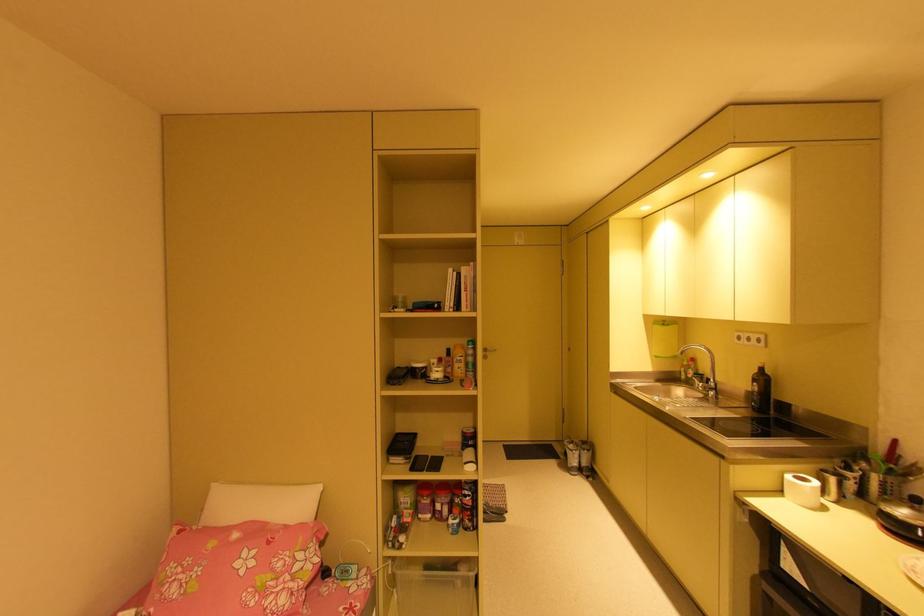
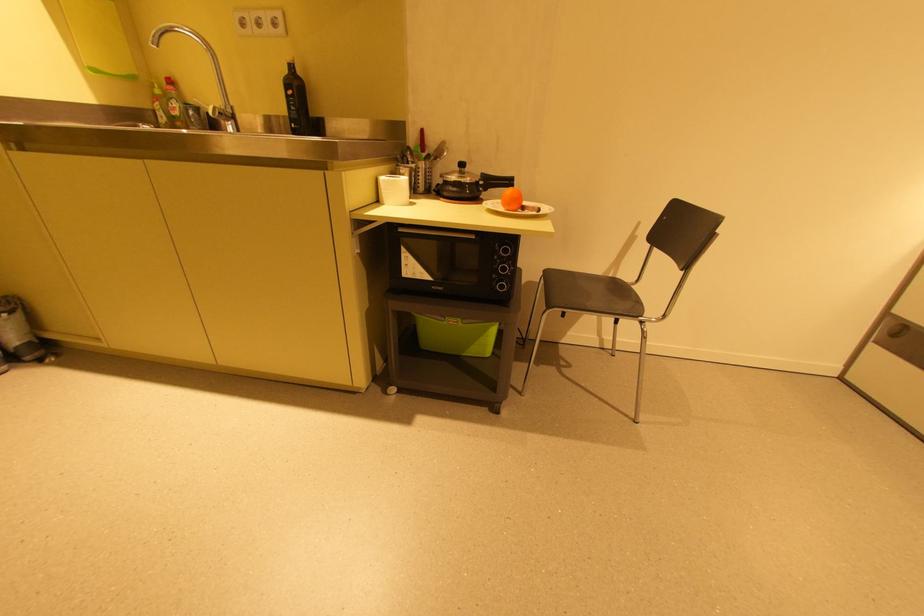
Locate, in the second image, the point that corresponds to pixel 794 477 in the first image.

(387, 179)